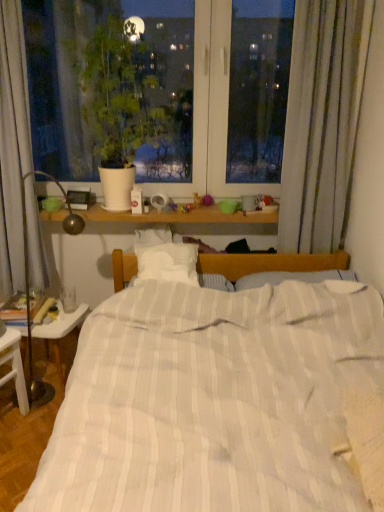
Question: From a real-world perspective, is white striped bed at center physically above white glossy table at lower left?

Choices:
 (A) no
 (B) yes

Answer: (B)

Question: Would you say white striped bed at center is outside white glossy table at lower left?

Choices:
 (A) yes
 (B) no

Answer: (A)

Question: Is white striped bed at center touching white glossy table at lower left?

Choices:
 (A) no
 (B) yes

Answer: (A)

Question: Is white striped bed at center turned away from white glossy table at lower left?

Choices:
 (A) no
 (B) yes

Answer: (A)

Question: Is white striped bed at center not near white glossy table at lower left?

Choices:
 (A) no
 (B) yes

Answer: (A)

Question: Does point (236, 458) appear closer or farther from the camera than point (6, 353)?

Choices:
 (A) closer
 (B) farther

Answer: (A)

Question: In the image, is white striped bed at center positioned in front of or behind white plastic nightstand at lower left?

Choices:
 (A) behind
 (B) front

Answer: (B)

Question: From the image's perspective, relative to white plastic nightstand at lower left, is white striped bed at center above or below?

Choices:
 (A) below
 (B) above

Answer: (B)

Question: In terms of width, does white striped bed at center look wider or thinner when compared to white plastic nightstand at lower left?

Choices:
 (A) wide
 (B) thin

Answer: (A)

Question: In the image, is green matte plant at upper left positioned in front of or behind white striped bed at center?

Choices:
 (A) behind
 (B) front

Answer: (A)

Question: Considering the positions of green matte plant at upper left and white striped bed at center in the image, is green matte plant at upper left bigger or smaller than white striped bed at center?

Choices:
 (A) big
 (B) small

Answer: (B)

Question: From the image's perspective, is green matte plant at upper left positioned above or below white striped bed at center?

Choices:
 (A) above
 (B) below

Answer: (A)

Question: In terms of width, does green matte plant at upper left look wider or thinner when compared to white striped bed at center?

Choices:
 (A) thin
 (B) wide

Answer: (A)

Question: Does point (8, 373) appear closer or farther from the camera than point (87, 76)?

Choices:
 (A) closer
 (B) farther

Answer: (A)

Question: Is white plastic nightstand at lower left wider or thinner than green matte plant at upper left?

Choices:
 (A) wide
 (B) thin

Answer: (B)